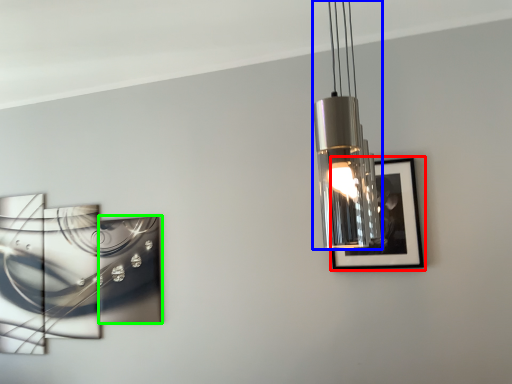
Question: Estimate the real-world distances between objects in this image. Which object is closer to picture frame (highlighted by a red box), lamp (highlighted by a blue box) or picture frame (highlighted by a green box)?

Choices:
 (A) lamp
 (B) picture frame

Answer: (A)